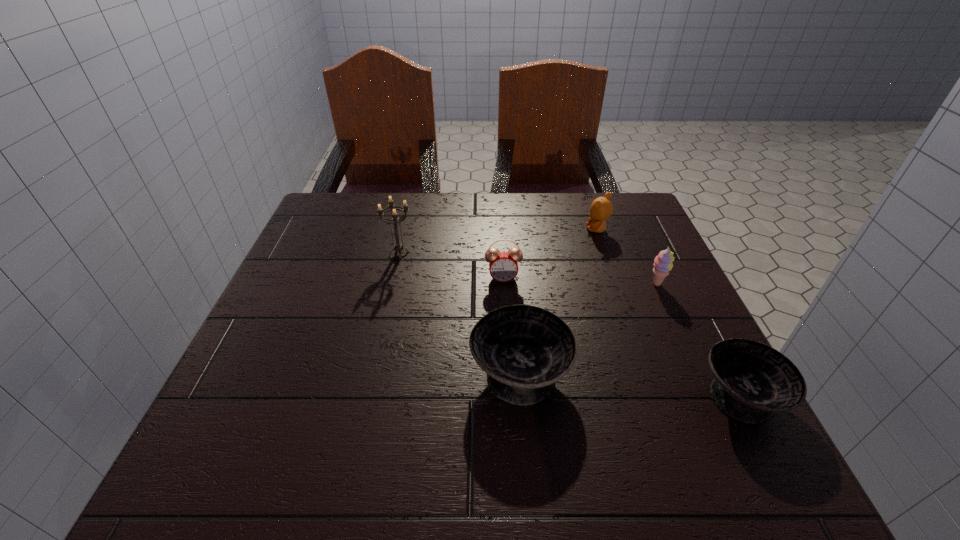
This screenshot has width=960, height=540. I want to click on object that ranks as the fourth closest to the candle holder, so click(663, 264).

Choose which object is the nearest neighbor to the fourth object from left to right. Please provide its 2D coordinates. Your answer should be formatted as a tuple, i.e. [(x, y)], where the tuple contains the x and y coordinates of a point satisfying the conditions above.

[(663, 264)]

Locate an element on the screen. blank space that satisfies the following two spatial constraints: 1. on the face of the third object from right to left; 2. on the clock face of the alarm clock is located at coordinates [614, 278].

Locate an element on the screen. Image resolution: width=960 pixels, height=540 pixels. free space that satisfies the following two spatial constraints: 1. on the clock face of the right bowl; 2. on the left side of the alarm clock is located at coordinates (510, 395).

Where is `free space that satisfies the following two spatial constraints: 1. on the face of the teddy bear; 2. on the clock face of the alarm clock`? Image resolution: width=960 pixels, height=540 pixels. free space that satisfies the following two spatial constraints: 1. on the face of the teddy bear; 2. on the clock face of the alarm clock is located at coordinates (614, 278).

The image size is (960, 540). What are the coordinates of `free region that satisfies the following two spatial constraints: 1. on the face of the farthest object; 2. on the clock face of the alarm clock` in the screenshot? It's located at (614, 278).

Where is `free space that satisfies the following two spatial constraints: 1. on the clock face of the alarm clock; 2. on the right side of the sherbert`? This screenshot has height=540, width=960. free space that satisfies the following two spatial constraints: 1. on the clock face of the alarm clock; 2. on the right side of the sherbert is located at coordinates (503, 285).

Where is `free space that satisfies the following two spatial constraints: 1. on the face of the teddy bear; 2. on the clock face of the alarm clock`? free space that satisfies the following two spatial constraints: 1. on the face of the teddy bear; 2. on the clock face of the alarm clock is located at coordinates (614, 278).

You are a GUI agent. You are given a task and a screenshot of the screen. Output one action in this format:
    pyautogui.click(x=<x>, y=<y>)
    Task: Click on the vacant area that satisfies the following two spatial constraints: 1. on the front side of the taller bowl; 2. on the right side of the right bowl
    Image resolution: width=960 pixels, height=540 pixels.
    Given the screenshot: What is the action you would take?
    pyautogui.click(x=522, y=395)

Where is `vacant space that satisfies the following two spatial constraints: 1. on the face of the teddy bear; 2. on the right side of the sherbert`? vacant space that satisfies the following two spatial constraints: 1. on the face of the teddy bear; 2. on the right side of the sherbert is located at coordinates (616, 285).